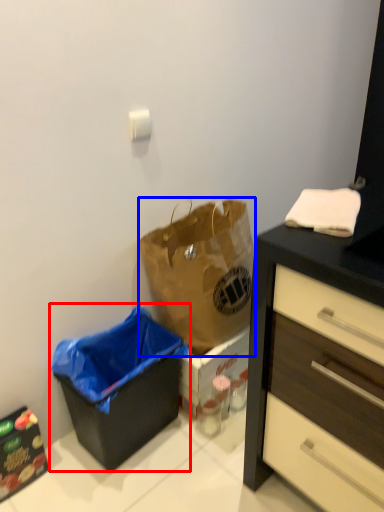
Question: Among these objects, which one is farthest to the camera, recycling bin (highlighted by a red box) or handbag (highlighted by a blue box)?

Choices:
 (A) recycling bin
 (B) handbag

Answer: (B)